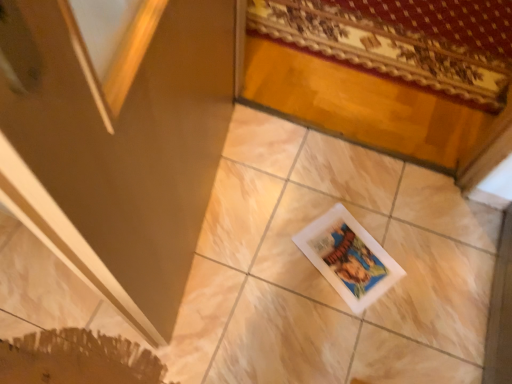
Question: Can you confirm if matte brown screen door at lower left is bigger than white matte picture frame at center?

Choices:
 (A) yes
 (B) no

Answer: (A)

Question: Is matte brown screen door at lower left smaller than white matte picture frame at center?

Choices:
 (A) yes
 (B) no

Answer: (B)

Question: From the image's perspective, is matte brown screen door at lower left on white matte picture frame at center?

Choices:
 (A) yes
 (B) no

Answer: (A)

Question: Is matte brown screen door at lower left surrounding white matte picture frame at center?

Choices:
 (A) no
 (B) yes

Answer: (A)

Question: From a real-world perspective, does matte brown screen door at lower left stand above white matte picture frame at center?

Choices:
 (A) yes
 (B) no

Answer: (A)

Question: Could you tell me if matte brown screen door at lower left is turned towards white matte picture frame at center?

Choices:
 (A) no
 (B) yes

Answer: (B)

Question: From the image's perspective, is white matte picture frame at center located beneath patterned fabric mat at upper right?

Choices:
 (A) no
 (B) yes

Answer: (B)

Question: Is white matte picture frame at center shorter than patterned fabric mat at upper right?

Choices:
 (A) yes
 (B) no

Answer: (A)

Question: Could you tell me if white matte picture frame at center is facing patterned fabric mat at upper right?

Choices:
 (A) yes
 (B) no

Answer: (B)

Question: Can you confirm if white matte picture frame at center is taller than patterned fabric mat at upper right?

Choices:
 (A) no
 (B) yes

Answer: (A)

Question: Does white matte picture frame at center come behind patterned fabric mat at upper right?

Choices:
 (A) yes
 (B) no

Answer: (B)

Question: Does white matte picture frame at center have a smaller size compared to patterned fabric mat at upper right?

Choices:
 (A) no
 (B) yes

Answer: (B)

Question: From a real-world perspective, is patterned fabric mat at upper right beneath matte brown screen door at lower left?

Choices:
 (A) yes
 (B) no

Answer: (A)